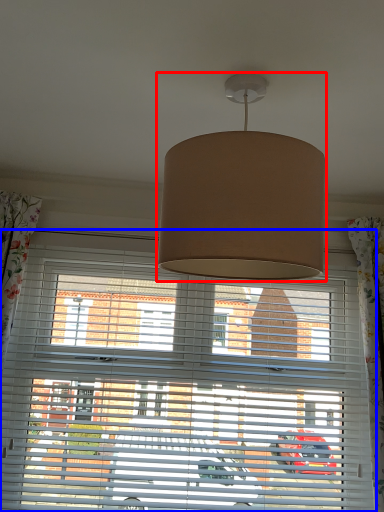
Question: Which point is further to the camera, lamp (highlighted by a red box) or window blind (highlighted by a blue box)?

Choices:
 (A) lamp
 (B) window blind

Answer: (B)